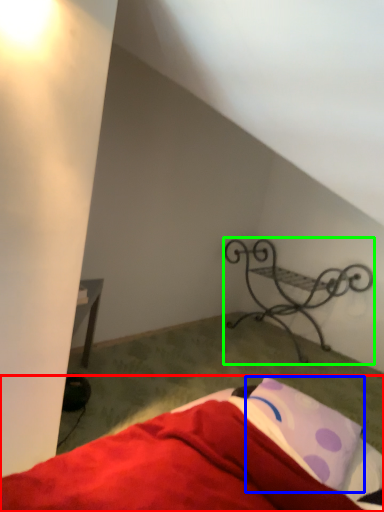
Question: Estimate the real-world distances between objects in this image. Which object is closer to bed (highlighted by a red box), pillow (highlighted by a blue box) or furniture (highlighted by a green box)?

Choices:
 (A) pillow
 (B) furniture

Answer: (A)